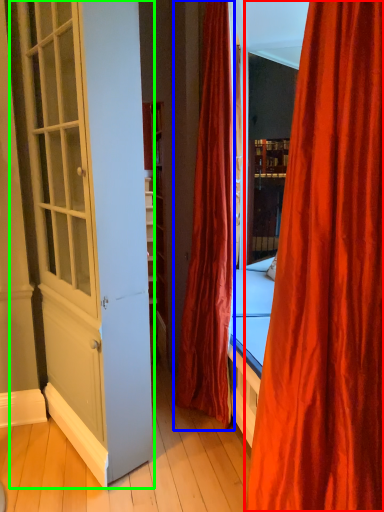
Question: Estimate the real-world distances between objects in this image. Which object is closer to curtain (highlighted by a red box), curtain (highlighted by a blue box) or screen door (highlighted by a green box)?

Choices:
 (A) curtain
 (B) screen door

Answer: (B)